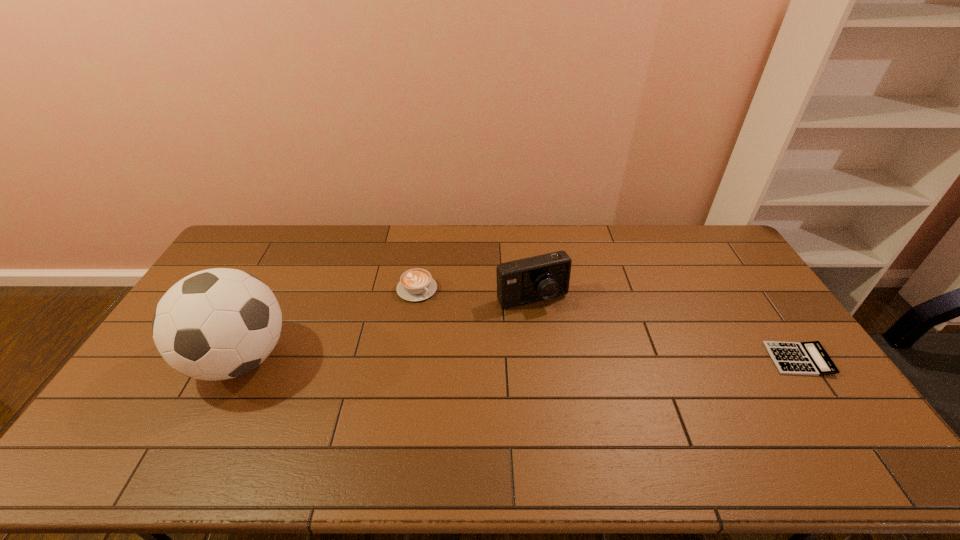
The height and width of the screenshot is (540, 960). Find the location of `free space between the leftmost object and the cappuccino`. free space between the leftmost object and the cappuccino is located at coordinates (328, 324).

This screenshot has width=960, height=540. Find the location of `free spot between the shortest object and the third object from left to right`. free spot between the shortest object and the third object from left to right is located at coordinates (665, 329).

Locate an element on the screen. unoccupied area between the third tallest object and the camera is located at coordinates (474, 294).

I want to click on vacant area that lies between the cappuccino and the third object from left to right, so click(x=474, y=294).

You are a GUI agent. You are given a task and a screenshot of the screen. Output one action in this format:
    pyautogui.click(x=<x>, y=<y>)
    Task: Click on the free space between the camera and the soccer ball
    
    Given the screenshot: What is the action you would take?
    pyautogui.click(x=386, y=329)

Where is `unoccupied position between the third object from right to left and the third shortest object`? The width and height of the screenshot is (960, 540). unoccupied position between the third object from right to left and the third shortest object is located at coordinates (474, 294).

What are the coordinates of `object that ranks as the third closest to the shortest object` in the screenshot? It's located at (216, 324).

You are a GUI agent. You are given a task and a screenshot of the screen. Output one action in this format:
    pyautogui.click(x=<x>, y=<y>)
    Task: Click on the closest object to the third object from right to left
    
    Given the screenshot: What is the action you would take?
    pyautogui.click(x=542, y=277)

Locate an element on the screen. This screenshot has height=540, width=960. vacant space that satisfies the following two spatial constraints: 1. on the back side of the soccer ball; 2. on the right side of the second tallest object is located at coordinates (272, 299).

Locate an element on the screen. This screenshot has width=960, height=540. free space that satisfies the following two spatial constraints: 1. on the front side of the second tallest object; 2. on the right side of the second shortest object is located at coordinates (416, 299).